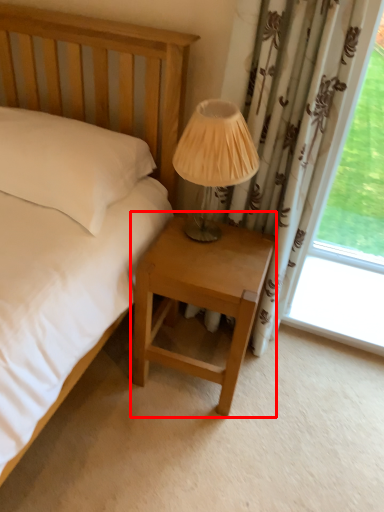
Question: Where is nightstand (annotated by the red box) located in relation to table lamp in the image?

Choices:
 (A) left
 (B) right

Answer: (A)